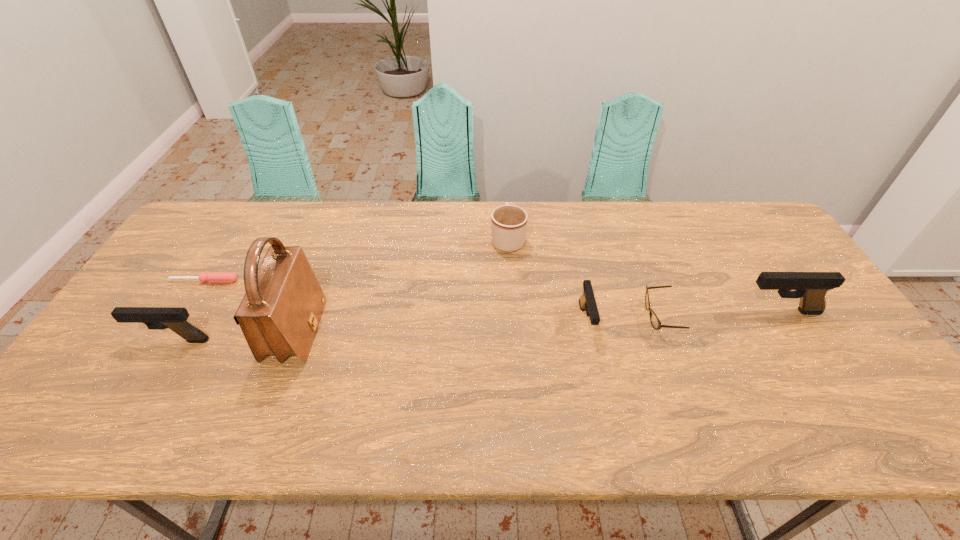
Where is `free spot located 0.140m on the side of the mug with the handle`? This screenshot has height=540, width=960. free spot located 0.140m on the side of the mug with the handle is located at coordinates (505, 201).

At what (x,y) coordinates should I click in order to perform the action: click on free spot located on the front flap of the shoulder bag. Please return your answer as a coordinate pair (x, y). Looking at the image, I should click on click(456, 332).

You are a GUI agent. You are given a task and a screenshot of the screen. Output one action in this format:
    pyautogui.click(x=<x>, y=<y>)
    Task: Click on the free space located 0.120m on the front-facing side of the spectacles
    The width and height of the screenshot is (960, 540).
    Given the screenshot: What is the action you would take?
    pyautogui.click(x=601, y=316)

Where is `vacant space located 0.050m on the front-facing side of the spectacles`? Image resolution: width=960 pixels, height=540 pixels. vacant space located 0.050m on the front-facing side of the spectacles is located at coordinates (627, 316).

I want to click on vacant space located on the front-facing side of the spectacles, so click(523, 316).

The height and width of the screenshot is (540, 960). Find the location of `object positioned at the far edge`. object positioned at the far edge is located at coordinates (508, 222).

Where is `object at the near edge`? The image size is (960, 540). object at the near edge is located at coordinates (279, 314).

You are a GUI agent. You are given a task and a screenshot of the screen. Output one action in this format:
    pyautogui.click(x=<x>, y=<y>)
    Task: Click on the pistol that is at the left edge
    
    Given the screenshot: What is the action you would take?
    pyautogui.click(x=157, y=318)

Where is `screwdriver at the left edge`? screwdriver at the left edge is located at coordinates (213, 277).

Image resolution: width=960 pixels, height=540 pixels. I want to click on object that is at the right edge, so (811, 287).